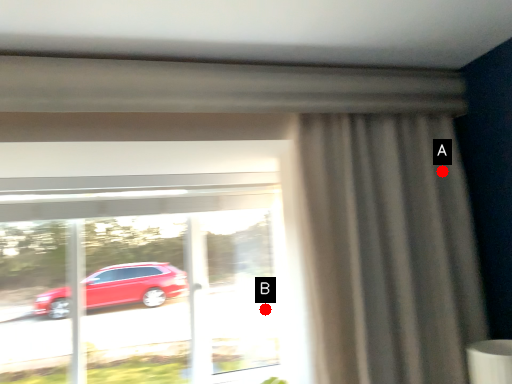
Question: Two points are circled on the image, labeled by A and B beside each circle. Which point appears closest to the camera in this image?

Choices:
 (A) A is closer
 (B) B is closer

Answer: (A)